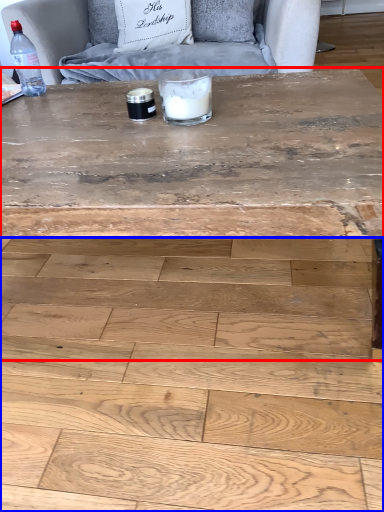
Question: Which point is closer to the camera, coffee table (highlighted by a red box) or plywood (highlighted by a blue box)?

Choices:
 (A) coffee table
 (B) plywood

Answer: (B)